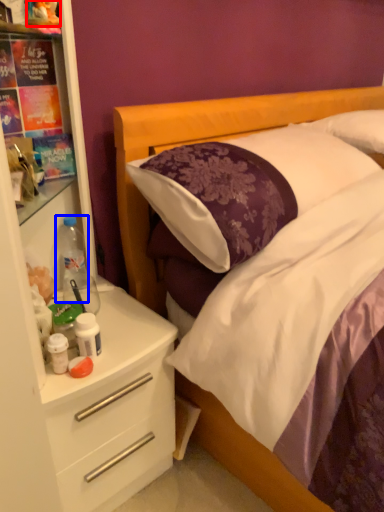
Question: Which point is further to the camera, toy (highlighted by a red box) or bottle (highlighted by a blue box)?

Choices:
 (A) toy
 (B) bottle

Answer: (B)